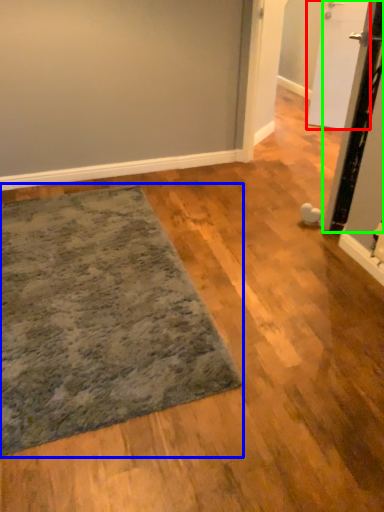
Question: Considering the real-world distances, which object is closest to door (highlighted by a red box)? mat (highlighted by a blue box) or door (highlighted by a green box).

Choices:
 (A) mat
 (B) door

Answer: (B)